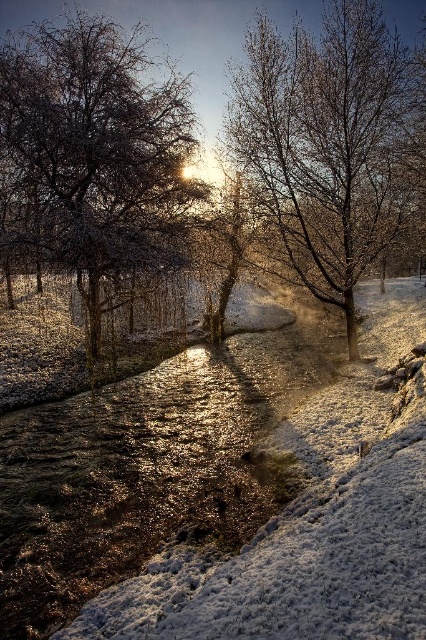
Question: Is frosty bark tree at center positioned at the back of snow-covered tree at center?

Choices:
 (A) yes
 (B) no

Answer: (B)

Question: Which of the following is the closest to the observer?

Choices:
 (A) (5, 76)
 (B) (322, 113)

Answer: (B)

Question: Does frosty bark tree at center come in front of snow-covered tree at center?

Choices:
 (A) yes
 (B) no

Answer: (A)

Question: Is frosty bark tree at center to the right of snow-covered tree at center from the viewer's perspective?

Choices:
 (A) no
 (B) yes

Answer: (A)